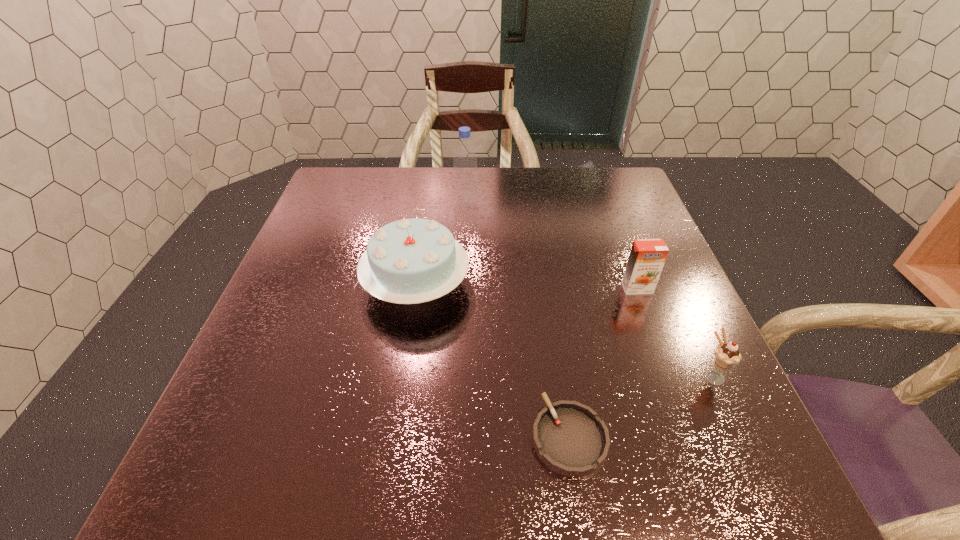
Where is `the farthest object`? The width and height of the screenshot is (960, 540). the farthest object is located at coordinates (466, 194).

This screenshot has height=540, width=960. I want to click on bottle, so click(x=466, y=194).

Identify the location of the fourth shortest object. The width and height of the screenshot is (960, 540). (409, 261).

You are a GUI agent. You are given a task and a screenshot of the screen. Output one action in this format:
    pyautogui.click(x=<x>, y=<y>)
    Task: Click on the fourth object from left to right
    
    Given the screenshot: What is the action you would take?
    pyautogui.click(x=647, y=257)

This screenshot has width=960, height=540. I want to click on the fourth farthest object, so click(x=726, y=355).

Identify the location of the rightmost object. The image size is (960, 540). (726, 355).

What are the coordinates of `ashtray` in the screenshot? It's located at (569, 438).

Find the location of a particular element. The image size is (960, 540). the shortest object is located at coordinates (569, 438).

The height and width of the screenshot is (540, 960). I want to click on vacant region located 0.080m on the front of the bottle, so click(x=466, y=226).

Find the location of a particular element. vacant space situated on the back of the fourth shortest object is located at coordinates (427, 211).